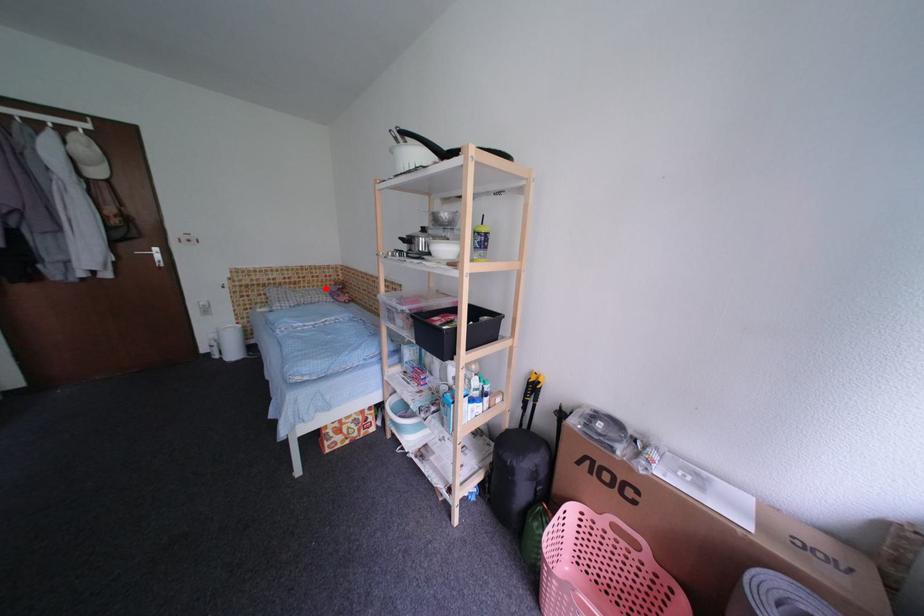
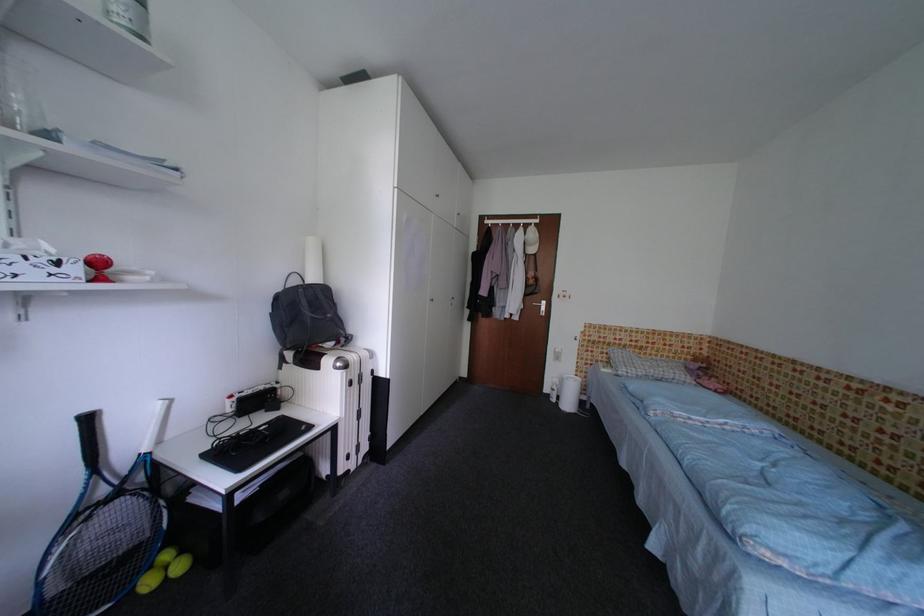
In the second image, find the point that corresponds to the highlighted location in the first image.

(675, 360)